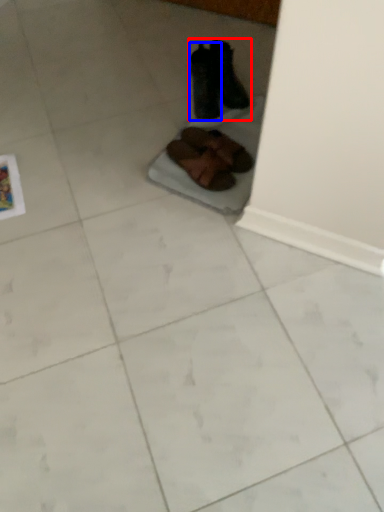
Question: Which object appears closest to the camera in this image, footwear (highlighted by a red box) or footwear (highlighted by a blue box)?

Choices:
 (A) footwear
 (B) footwear

Answer: (B)